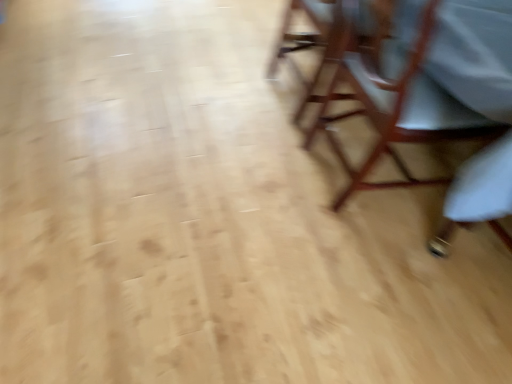
Question: Does wooden chair at right, the 2th chair positioned from the back, turn towards wooden chair at upper right, the 1th chair positioned from the back?

Choices:
 (A) yes
 (B) no

Answer: (B)

Question: From a real-world perspective, is wooden chair at right, arranged as the 1th chair when viewed from the front, on top of wooden chair at upper right, which is the second chair from front to back?

Choices:
 (A) yes
 (B) no

Answer: (A)

Question: Is wooden chair at right, the 2th chair positioned from the back, to the right of wooden chair at upper right, the 1th chair positioned from the back, from the viewer's perspective?

Choices:
 (A) yes
 (B) no

Answer: (A)

Question: Is wooden chair at right, the 2th chair positioned from the back, positioned behind wooden chair at upper right, which is the second chair from front to back?

Choices:
 (A) no
 (B) yes

Answer: (A)

Question: Is wooden chair at right, arranged as the 1th chair when viewed from the front, positioned beyond the bounds of wooden chair at upper right, the 1th chair positioned from the back?

Choices:
 (A) no
 (B) yes

Answer: (B)

Question: Could wooden chair at upper right, the 1th chair positioned from the back, be considered to be inside wooden chair at right, arranged as the 1th chair when viewed from the front?

Choices:
 (A) yes
 (B) no

Answer: (B)

Question: Can you confirm if wooden chair at upper right, the 1th chair positioned from the back, is taller than wooden chair at right, the 2th chair positioned from the back?

Choices:
 (A) no
 (B) yes

Answer: (A)

Question: Is wooden chair at upper right, the 1th chair positioned from the back, positioned behind wooden chair at right, the 2th chair positioned from the back?

Choices:
 (A) yes
 (B) no

Answer: (A)

Question: Are wooden chair at upper right, which is the second chair from front to back, and wooden chair at right, arranged as the 1th chair when viewed from the front, making contact?

Choices:
 (A) no
 (B) yes

Answer: (A)

Question: Does wooden chair at upper right, the 1th chair positioned from the back, have a larger size compared to wooden chair at right, the 2th chair positioned from the back?

Choices:
 (A) yes
 (B) no

Answer: (B)

Question: Can you confirm if wooden chair at upper right, which is the second chair from front to back, is thinner than wooden chair at right, arranged as the 1th chair when viewed from the front?

Choices:
 (A) yes
 (B) no

Answer: (A)

Question: Can you confirm if wooden chair at upper right, the 1th chair positioned from the back, is positioned to the right of wooden chair at right, arranged as the 1th chair when viewed from the front?

Choices:
 (A) no
 (B) yes

Answer: (A)

Question: Is wooden chair at right, the 2th chair positioned from the back, in front of or behind wooden chair at upper right, the 1th chair positioned from the back, in the image?

Choices:
 (A) front
 (B) behind

Answer: (A)